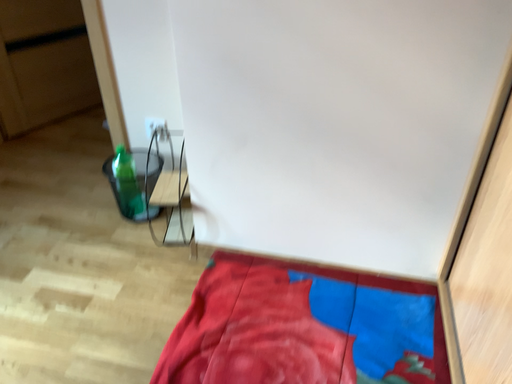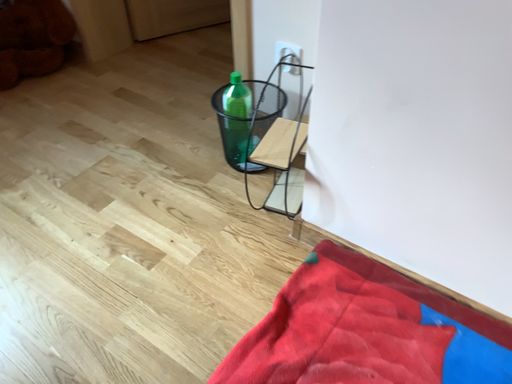
Question: How did the camera likely rotate when shooting the video?

Choices:
 (A) rotated upward
 (B) rotated downward

Answer: (B)